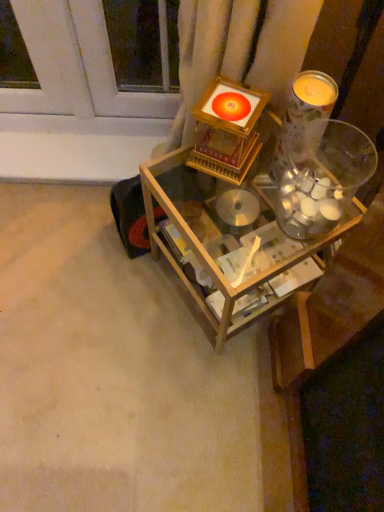
At what (x,y) coordinates should I click in order to perform the action: click on wooden table at center. Please return your answer as a coordinate pair (x, y). Looking at the image, I should click on (225, 242).

Looking at their sizes, would you say translucent glass candle at upper right is wider or thinner than wooden table at center?

Considering their sizes, translucent glass candle at upper right looks slimmer than wooden table at center.

Is translucent glass candle at upper right outside of wooden table at center?

Indeed, translucent glass candle at upper right is completely outside wooden table at center.

Is translucent glass candle at upper right to the left or to the right of wooden table at center in the image?

Based on their positions, translucent glass candle at upper right is located to the right of wooden table at center.

Is wooden table at center situated inside translucent glass candle at upper right or outside?

wooden table at center is not inside translucent glass candle at upper right, it's outside.

From a real-world perspective, who is located higher, wooden table at center or translucent glass candle at upper right?

translucent glass candle at upper right.

Considering the relative sizes of wooden table at center and translucent glass candle at upper right in the image provided, is wooden table at center taller than translucent glass candle at upper right?

Indeed, wooden table at center has a greater height compared to translucent glass candle at upper right.

Is wooden table at center next to translucent glass candle at upper right?

wooden table at center and translucent glass candle at upper right are not in contact.

Is clear glass jar at upper right a part of translucent glass candle at upper right?

That's incorrect, clear glass jar at upper right is not inside translucent glass candle at upper right.

From the image's perspective, which one is positioned lower, translucent glass candle at upper right or clear glass jar at upper right?

From the image's view, clear glass jar at upper right is below.

Is translucent glass candle at upper right looking in the opposite direction of clear glass jar at upper right?

No, translucent glass candle at upper right is not facing the opposite direction of clear glass jar at upper right.

Are translucent glass candle at upper right and clear glass jar at upper right beside each other?

Yes, translucent glass candle at upper right is touching clear glass jar at upper right.

Looking at this image, does clear glass jar at upper right turn towards wooden table at center?

No.

Considering the positions of point (326, 177) and point (272, 228), is point (326, 177) closer or farther from the camera than point (272, 228)?

Point (326, 177) appears to be closer to the viewer than point (272, 228).

From the image's perspective, is clear glass jar at upper right located above wooden table at center?

Indeed, from the image's perspective, clear glass jar at upper right is shown above wooden table at center.

The image size is (384, 512). What are the coordinates of `glass jar in front of the wooden table at center` in the screenshot? It's located at (322, 176).

Can you confirm if clear glass jar at upper right is taller than translucent glass candle at upper right?

No, clear glass jar at upper right is not taller than translucent glass candle at upper right.

Based on the photo, between clear glass jar at upper right and translucent glass candle at upper right, which one is positioned behind?

translucent glass candle at upper right is behind.

From the picture: Could you tell me if clear glass jar at upper right is turned towards translucent glass candle at upper right?

No.

Considering the positions of objects clear glass jar at upper right and translucent glass candle at upper right in the image provided, who is more to the right, clear glass jar at upper right or translucent glass candle at upper right?

From the viewer's perspective, clear glass jar at upper right appears more on the right side.

Where is `table behind the clear glass jar at upper right`? The width and height of the screenshot is (384, 512). table behind the clear glass jar at upper right is located at coordinates (225, 242).

Is the surface of wooden table at center in direct contact with clear glass jar at upper right?

There is a gap between wooden table at center and clear glass jar at upper right.

In terms of width, does wooden table at center look wider or thinner when compared to clear glass jar at upper right?

Considering their sizes, wooden table at center looks broader than clear glass jar at upper right.

Based on the photo, how much distance is there between wooden table at center and clear glass jar at upper right?

wooden table at center and clear glass jar at upper right are 12.02 centimeters apart.

This screenshot has height=512, width=384. Find the location of `table behind the translucent glass candle at upper right`. table behind the translucent glass candle at upper right is located at coordinates (225, 242).

This screenshot has width=384, height=512. In order to click on candle holder located above the wooden table at center (from a real-world perspective) in this screenshot , I will do `click(306, 106)`.

Estimate the real-world distances between objects in this image. Which object is further from wooden table at center, translucent glass candle at upper right or clear glass jar at upper right?

translucent glass candle at upper right lies further to wooden table at center than the other object.

When comparing their distances from clear glass jar at upper right, does translucent glass candle at upper right or wooden table at center seem closer?

Among the two, translucent glass candle at upper right is located nearer to clear glass jar at upper right.

Estimate the real-world distances between objects in this image. Which object is closer to wooden table at center, clear glass jar at upper right or translucent glass candle at upper right?

The object closer to wooden table at center is clear glass jar at upper right.

Which object lies nearer to the anchor point translucent glass candle at upper right, clear glass jar at upper right or wooden table at center?

Among the two, clear glass jar at upper right is located nearer to translucent glass candle at upper right.

Considering their positions, is wooden table at center positioned closer to translucent glass candle at upper right than clear glass jar at upper right?

The object closer to translucent glass candle at upper right is clear glass jar at upper right.

Based on their spatial positions, is wooden table at center or translucent glass candle at upper right closer to clear glass jar at upper right?

translucent glass candle at upper right is positioned closer to the anchor clear glass jar at upper right.

Locate an element on the screen. This screenshot has height=512, width=384. glass jar between translucent glass candle at upper right and wooden table at center vertically is located at coordinates (322, 176).